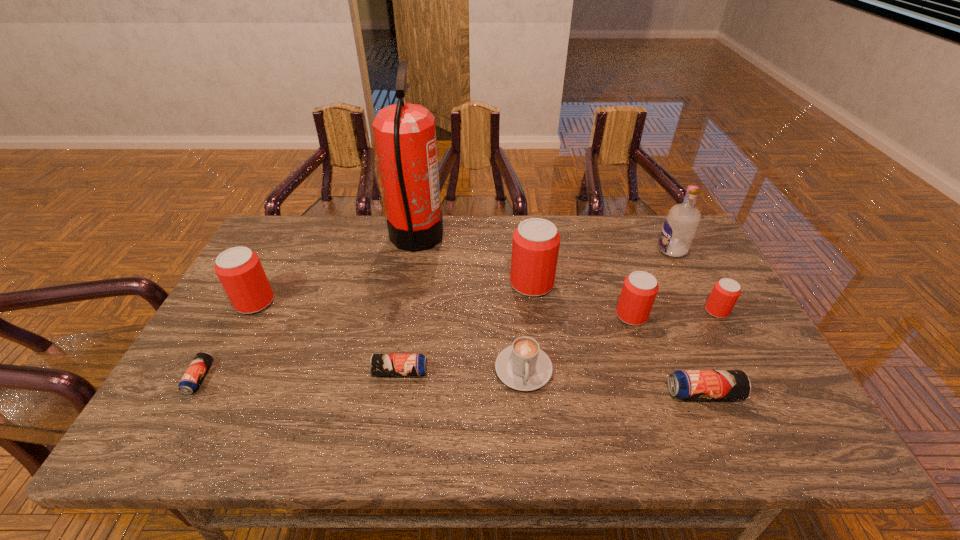
Where is `free space between the fifth tallest beer can and the fourth tallest beer can`? The height and width of the screenshot is (540, 960). free space between the fifth tallest beer can and the fourth tallest beer can is located at coordinates (710, 352).

Find the location of a particular element. free space between the black fire extinguisher and the rightmost red beer can is located at coordinates (566, 275).

Where is `free space between the fifth tallest beer can and the fire extinguisher`? The image size is (960, 540). free space between the fifth tallest beer can and the fire extinguisher is located at coordinates (561, 316).

You are a GUI agent. You are given a task and a screenshot of the screen. Output one action in this format:
    pyautogui.click(x=<x>, y=<y>)
    Task: Click on the unoccupied area between the cappuccino and the sixth shortest object
    The image size is (960, 540).
    Given the screenshot: What is the action you would take?
    pyautogui.click(x=578, y=342)

Image resolution: width=960 pixels, height=540 pixels. I want to click on free space between the cappuccino and the vodka, so click(x=598, y=309).

Identify the location of free area in between the fourth tallest object and the rightmost beer can. The width and height of the screenshot is (960, 540). (486, 307).

Identify the location of vacant space that is in between the black fire extinguisher and the rightmost red beer can. This screenshot has height=540, width=960. (566, 275).

I want to click on object that is the fifth closest one to the second blue beer can from left to right, so click(189, 383).

Locate an element on the screen. This screenshot has height=540, width=960. the ninth closest object relative to the vodka is located at coordinates (189, 383).

Locate an element on the screen. This screenshot has width=960, height=540. beer can that is the sixth closest to the rightmost beer can is located at coordinates (189, 383).